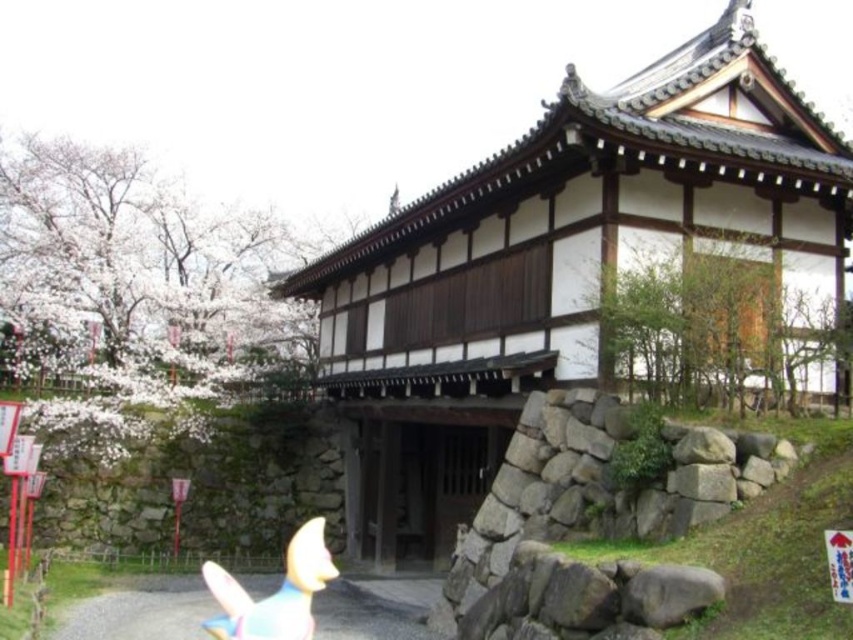
Question: Is white wooden temple at center positioned behind matte yellow plush toy at lower left?

Choices:
 (A) no
 (B) yes

Answer: (B)

Question: Can you confirm if white wooden temple at center is smaller than matte yellow plush toy at lower left?

Choices:
 (A) yes
 (B) no

Answer: (B)

Question: Can you confirm if white wooden temple at center is positioned to the left of matte yellow plush toy at lower left?

Choices:
 (A) yes
 (B) no

Answer: (B)

Question: Which point is farther to the camera?

Choices:
 (A) matte yellow plush toy at lower left
 (B) white wooden temple at center

Answer: (B)